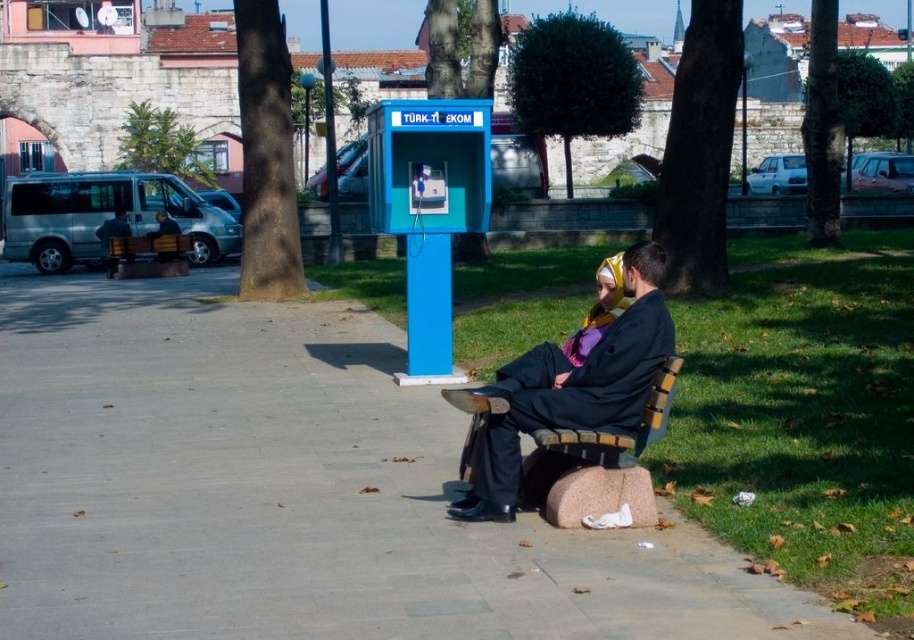
Looking at this image, you are a delivery person who needs to deliver a package to the blue plastic phone booth at center. You are currently standing next to the dark blue suit at left. Can you reach the phone booth without crossing any roads or obstacles?

The blue plastic phone booth at center and dark blue suit at left are 37.66 feet apart from each other. Since there are no roads or obstacles mentioned between them in the scene, you can walk directly to the phone booth.

You are standing in the plaza and see the blue plastic phone booth at center and the dark blue suit at left. Which object is positioned to the right of the other?

The blue plastic phone booth at center is positioned to the right of the dark blue suit at left.